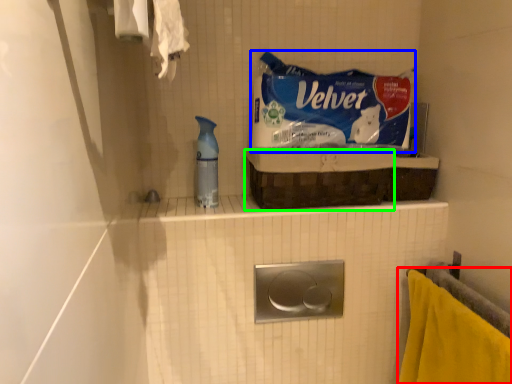
Question: Considering the real-world distances, which object is farthest from towel (highlighted by a red box)? product (highlighted by a blue box) or basket (highlighted by a green box)?

Choices:
 (A) product
 (B) basket

Answer: (A)